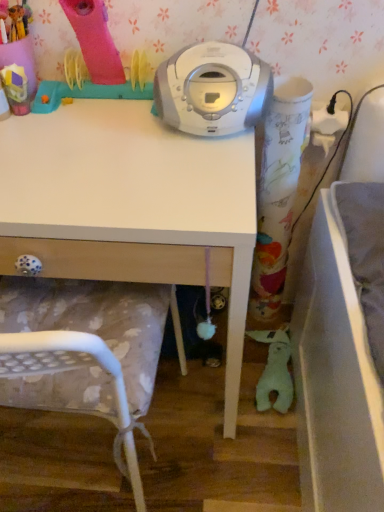
You are a GUI agent. You are given a task and a screenshot of the screen. Output one action in this format:
    pyautogui.click(x=<x>, y=<y>)
    Task: Click on the free space above white matte desk at center (from a real-world perspective)
    The image size is (384, 512).
    Given the screenshot: What is the action you would take?
    pyautogui.click(x=99, y=144)